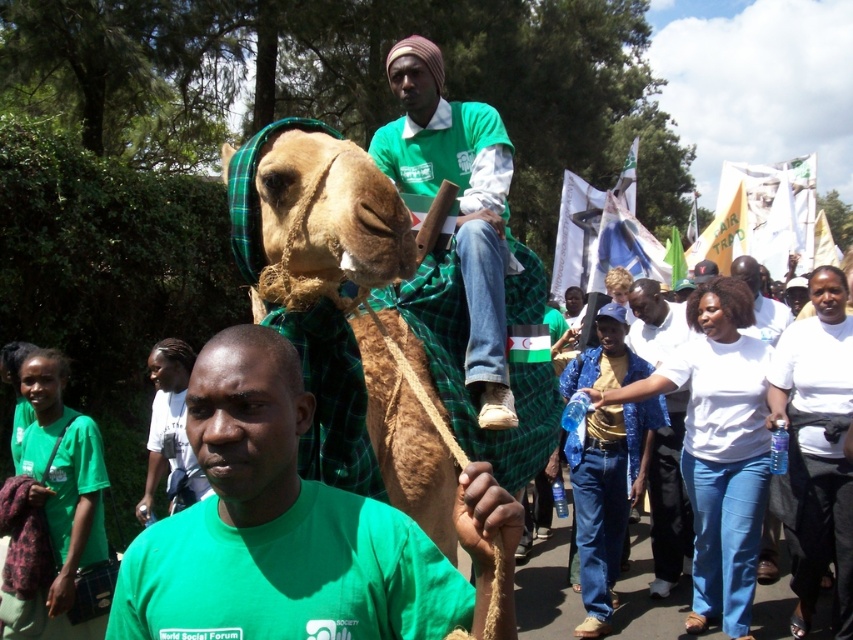
You are a photographer at the event and want to capture a clear shot of the brown woolen camel at center without the green fabric cloth at center blocking it. How should you adjust your camera angle?

The brown woolen camel at center is positioned under the green fabric cloth at center, so to avoid the cloth blocking the view, you should angle your camera downward to capture the camel from above.

You are a photographer at the event and need to capture a clear photo of both the green fabric cloth at center and the white cotton shirt at center. Which object should you focus on first to ensure it appears larger in the photo?

The green fabric cloth at center is larger than the white cotton shirt at center, so you should focus on the green fabric cloth at center first to ensure it appears larger in the photo.